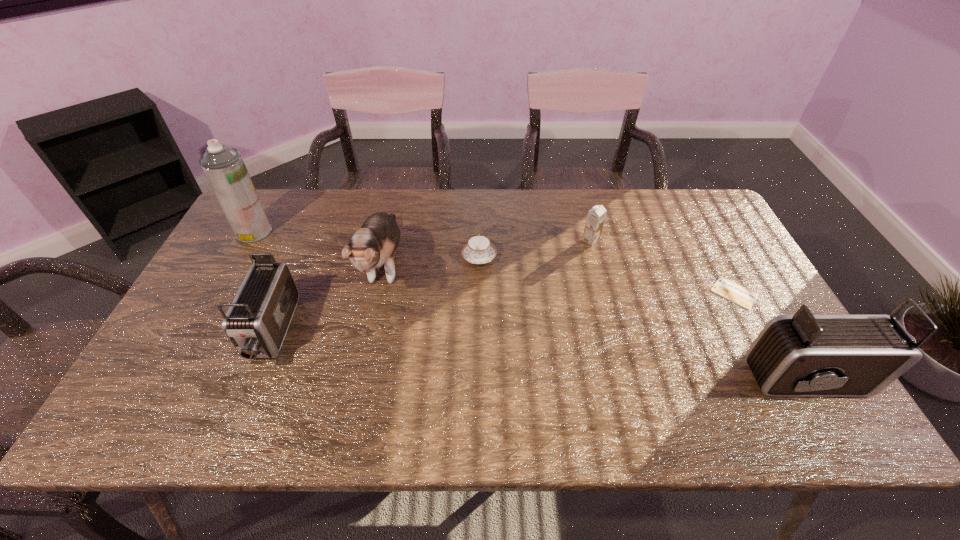
Where is `chocolate milk at the far edge`? The image size is (960, 540). chocolate milk at the far edge is located at coordinates (596, 216).

The image size is (960, 540). Identify the location of object that is at the left edge. (224, 168).

Identify the location of camcorder at the right edge. The height and width of the screenshot is (540, 960). (803, 355).

The width and height of the screenshot is (960, 540). What are the coordinates of `identity card located in the right edge section of the desktop` in the screenshot? It's located at (723, 287).

At what (x,y) coordinates should I click in order to perform the action: click on object at the far left corner. Please return your answer as a coordinate pair (x, y). Looking at the image, I should click on (224, 168).

This screenshot has width=960, height=540. Identify the location of object at the near right corner. (803, 355).

Locate an element on the screen. free space at the far edge of the desktop is located at coordinates (638, 223).

Where is `free space at the near edge of the desktop`? The height and width of the screenshot is (540, 960). free space at the near edge of the desktop is located at coordinates (320, 379).

I want to click on vacant area at the right edge, so click(762, 307).

This screenshot has height=540, width=960. Identify the location of free space at the far left corner of the desktop. (283, 190).